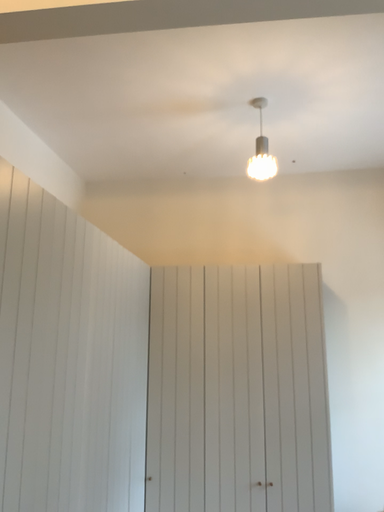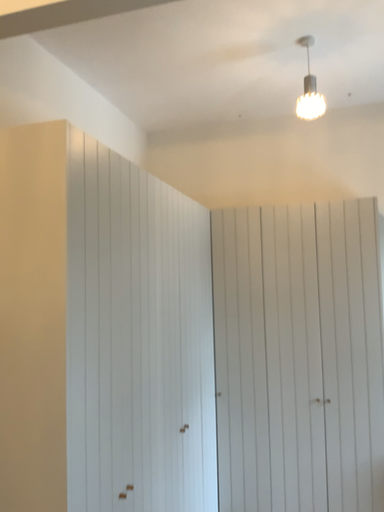
Question: Which way did the camera rotate in the video?

Choices:
 (A) rotated right
 (B) rotated left

Answer: (B)